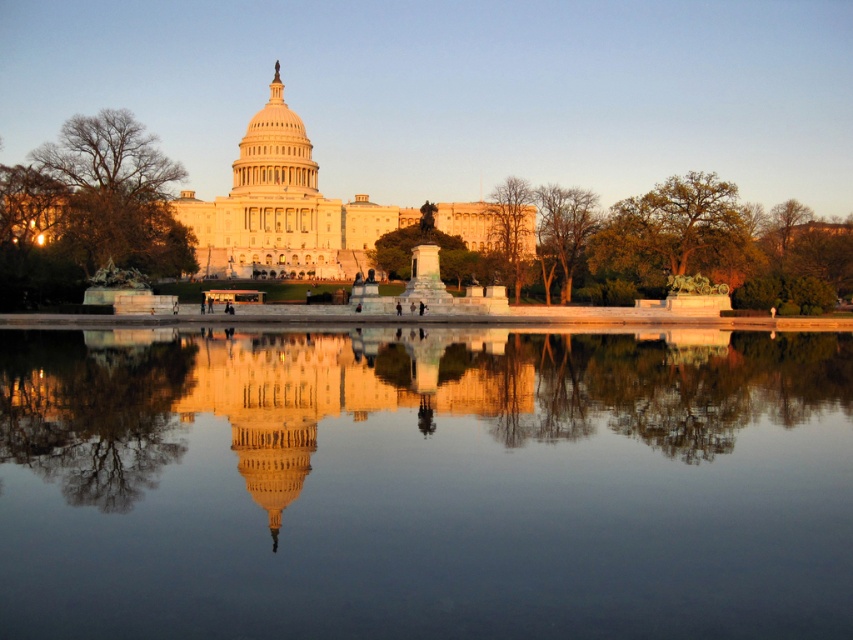
You are a photographer planning to capture the United States Capitol building with both the bare branches at left and green leafy tree at right in the frame. Which tree should you focus on to ensure it takes up more space in your photo?

The bare branches at left should be focused on because it is bigger than the green leafy tree at right, making it occupy more space in the photo.

You are standing in front of the United States Capitol building and notice the bare branches at left. Based on their 2D location coordinates, where exactly are they positioned in the image?

The bare branches at left are positioned at the coordinates point (99, 196).